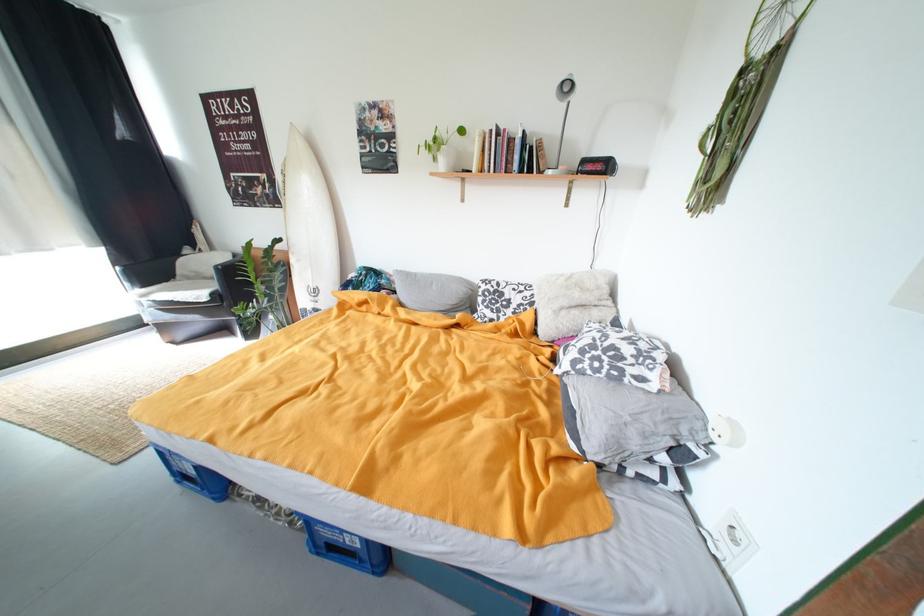
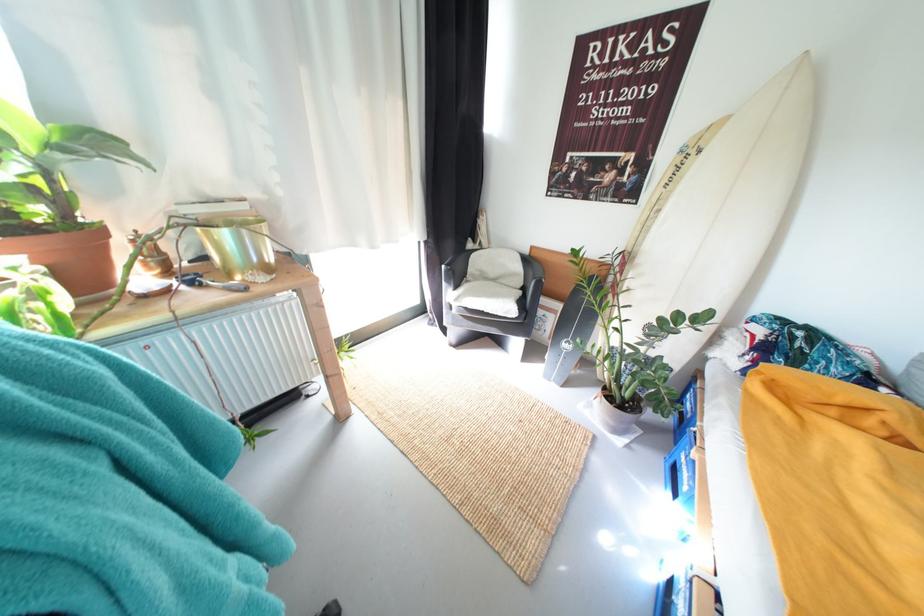
Question: What movement of the cameraman would produce the second image?

Choices:
 (A) Left
 (B) Right
 (C) Forward
 (D) Backward

Answer: (A)